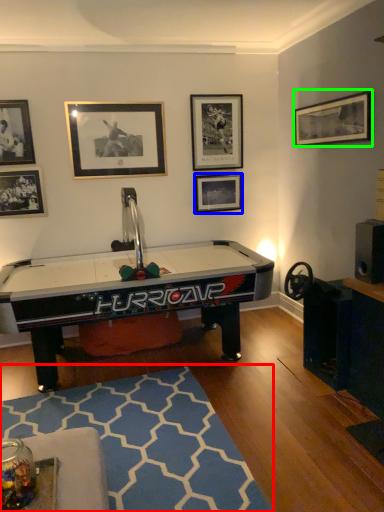
Question: Which object is the closest to the mat (highlighted by a red box)? Choose among these: picture frame (highlighted by a blue box) or picture frame (highlighted by a green box).

Choices:
 (A) picture frame
 (B) picture frame

Answer: (A)